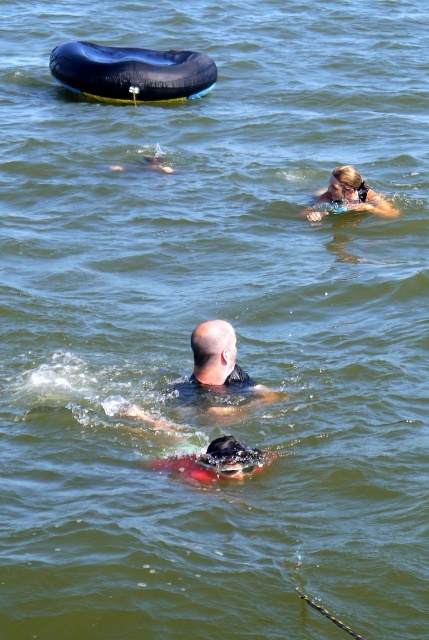
In the scene shown: You are a lifeguard observing the scene. There is a bald head at center and a dark gray rubber swim cap at center in the water. Which object is positioned to the right?

The bald head at center is positioned to the right of the dark gray rubber swim cap at center.

You are a photographer trying to capture a clear shot of both the bald head at center and the blonde hair swimmer at upper right. Given their sizes, which one should you zoom in on first to ensure both are in focus?

The bald head at center is smaller than the blonde hair swimmer at upper right, so you should zoom in on the blonde hair swimmer at upper right first to ensure both are in focus.